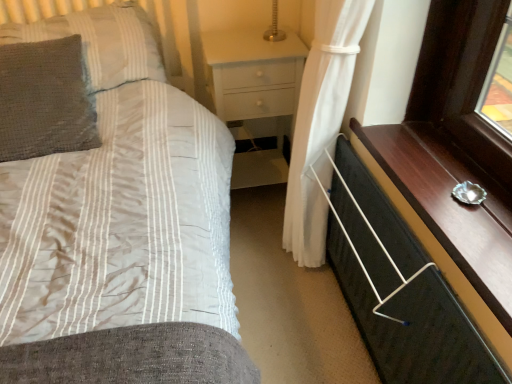
In order to click on free location in front of white fabric curtain at lower right in this screenshot , I will do `click(300, 344)`.